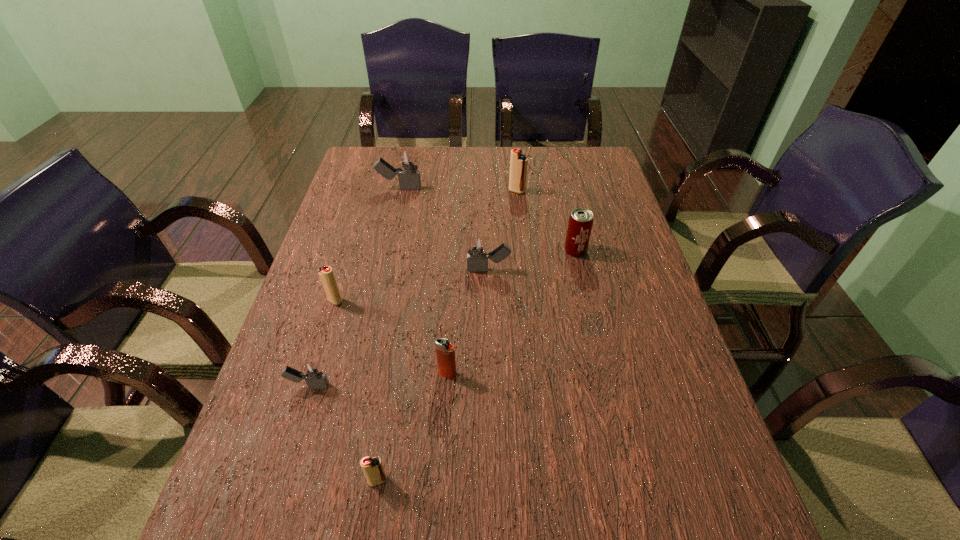
Find the location of a particular element. The height and width of the screenshot is (540, 960). the nearest object is located at coordinates (373, 469).

Where is `the nearest igniter`? This screenshot has height=540, width=960. the nearest igniter is located at coordinates (373, 469).

In order to click on the nearest gray igniter in this screenshot , I will do `click(311, 372)`.

In order to click on vacant space located 0.140m on the left of the rightmost igniter in this screenshot , I will do `click(467, 191)`.

This screenshot has width=960, height=540. I want to click on blank area located 0.360m on the right of the biggest gray igniter, so click(x=530, y=188).

Find the location of a particular element. The image size is (960, 540). free point located on the left of the third farthest object is located at coordinates (528, 251).

Where is `blank area located 0.070m on the back of the fifth nearest object`? blank area located 0.070m on the back of the fifth nearest object is located at coordinates (x=488, y=245).

Where is `free space located 0.130m on the back of the leftmost red igniter`? free space located 0.130m on the back of the leftmost red igniter is located at coordinates (348, 261).

Find the location of `free space located 0.230m on the left of the fifth igniter from left to right`. free space located 0.230m on the left of the fifth igniter from left to right is located at coordinates (333, 374).

The image size is (960, 540). I want to click on vacant area situated on the right of the nearest red igniter, so click(508, 481).